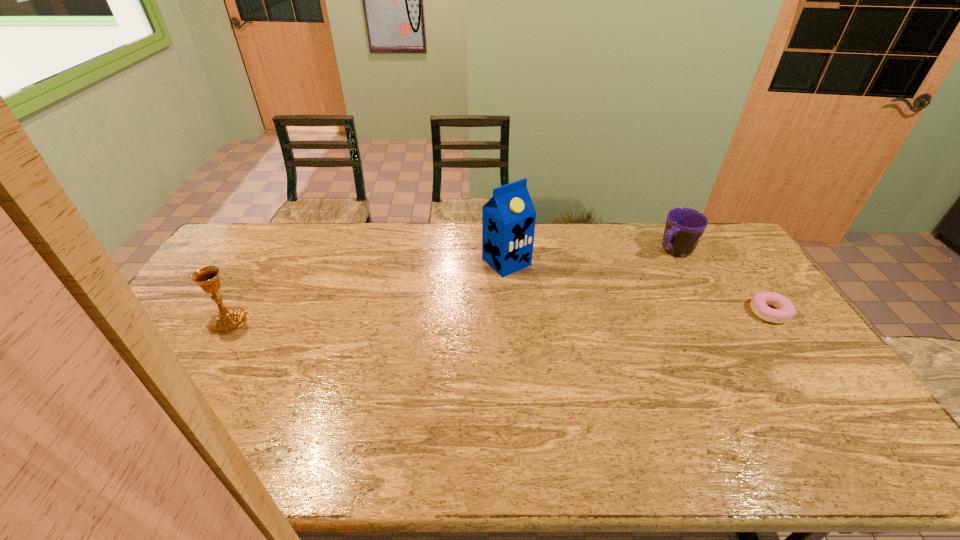
Identify the location of free space on the desktop that is between the second tallest object and the rightmost object and is positioned with the cap open on the carton. This screenshot has height=540, width=960. (565, 315).

Locate an element on the screen. The width and height of the screenshot is (960, 540). vacant space on the desktop that is between the leftmost object and the pastry and is positioned with the handle on the side of the third tallest object is located at coordinates (577, 315).